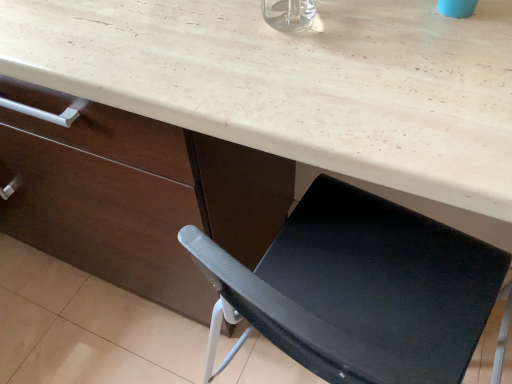
Locate an element on the screen. The image size is (512, 384). free point above matte wood countertop at center (from a real-world perspective) is located at coordinates (381, 105).